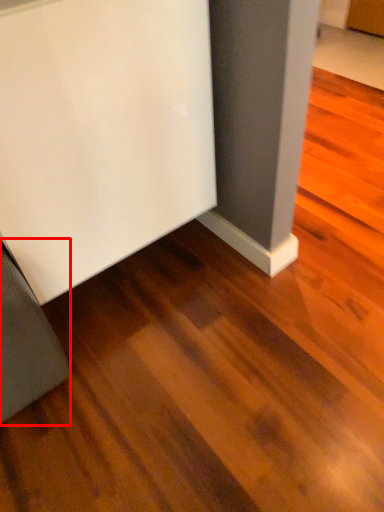
Question: In this image, where is furniture (annotated by the red box) located relative to furniture?

Choices:
 (A) left
 (B) right

Answer: (A)